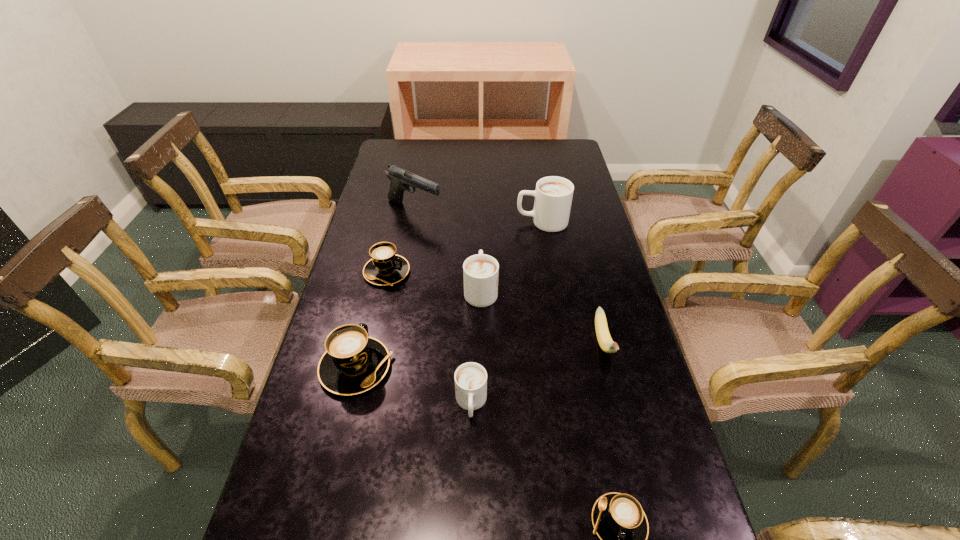
Locate an element on the screen. This screenshot has width=960, height=540. vacant space located 0.100m on the side with the handle of the tallest cappuccino is located at coordinates pyautogui.click(x=487, y=221).

Identify the location of free space located on the side with the handle of the tallest cappuccino. This screenshot has width=960, height=540. (467, 221).

Find the location of a particular element. The width and height of the screenshot is (960, 540). free point located on the side with the handle of the second biggest white cappuccino is located at coordinates (481, 253).

You are a GUI agent. You are given a task and a screenshot of the screen. Output one action in this format:
    pyautogui.click(x=<x>, y=<y>)
    Task: Click on the vacant space situated on the side with the handle of the second biggest white cappuccino
    This screenshot has width=960, height=540.
    Given the screenshot: What is the action you would take?
    pyautogui.click(x=481, y=255)

Where is `free spot located 0.220m on the side with the handle of the second biggest white cappuccino`? The image size is (960, 540). free spot located 0.220m on the side with the handle of the second biggest white cappuccino is located at coordinates (481, 228).

At what (x,y) coordinates should I click in order to perform the action: click on vacant area located on the front of the biggest black cappuccino. Please return your answer as a coordinate pair (x, y). The width and height of the screenshot is (960, 540). Looking at the image, I should click on (315, 537).

I want to click on vacant space located at the stem of the banana, so click(651, 532).

The width and height of the screenshot is (960, 540). What are the coordinates of `vacant space located 0.100m on the side with the handle of the nearest white cappuccino` in the screenshot? It's located at (470, 470).

You are a GUI agent. You are given a task and a screenshot of the screen. Output one action in this format:
    pyautogui.click(x=<x>, y=<y>)
    Task: Click on the free point located 0.320m on the front of the farthest black cappuccino
    
    Given the screenshot: What is the action you would take?
    pyautogui.click(x=362, y=384)

You are a GUI agent. You are given a task and a screenshot of the screen. Output one action in this format:
    pyautogui.click(x=<x>, y=<y>)
    Task: Click on the gun that is at the left edge
    
    Given the screenshot: What is the action you would take?
    pyautogui.click(x=401, y=179)